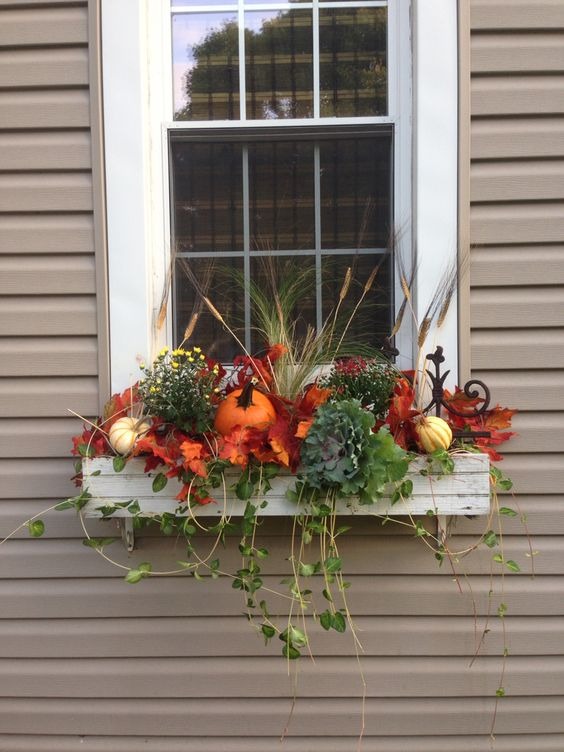
The image size is (564, 752). Identify the location of window glass. 199,55, 281,50, 349,82.